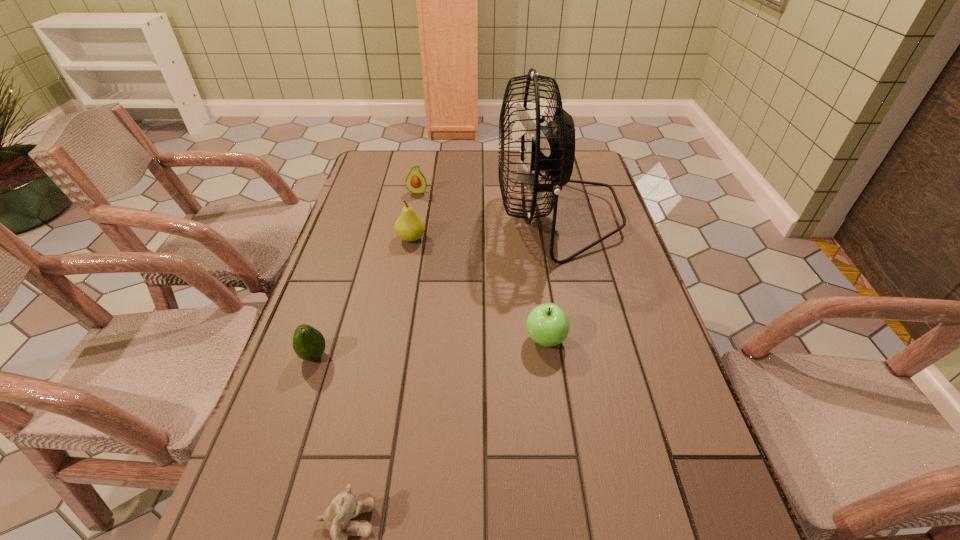
At what (x,y) coordinates should I click in order to perform the action: click on object that stands as the third closest to the pear. Please return your answer as a coordinate pair (x, y). Image resolution: width=960 pixels, height=540 pixels. Looking at the image, I should click on (308, 343).

Where is `free space that satisfies the following two spatial constraints: 1. on the cut side of the right avocado; 2. on the right side of the pear`? The height and width of the screenshot is (540, 960). free space that satisfies the following two spatial constraints: 1. on the cut side of the right avocado; 2. on the right side of the pear is located at coordinates (408, 239).